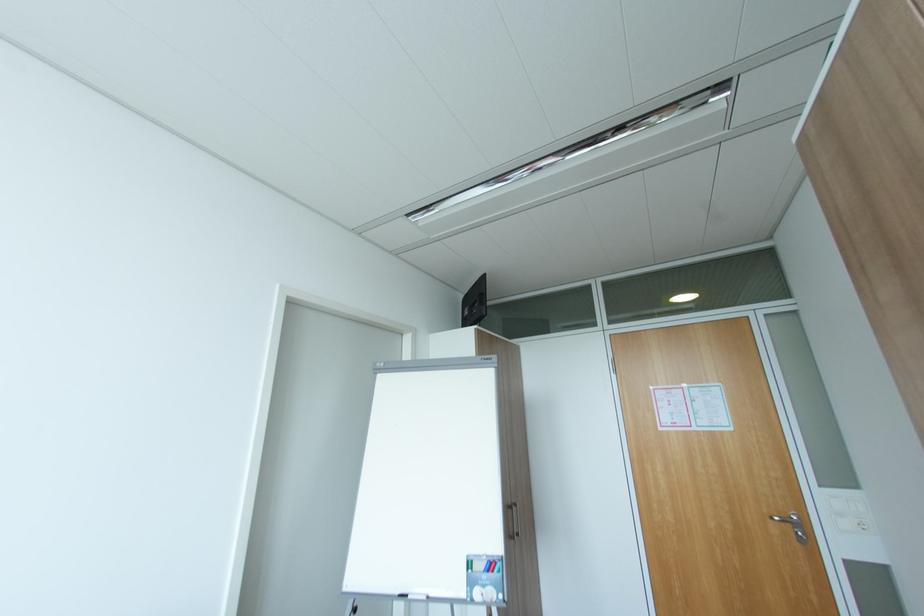
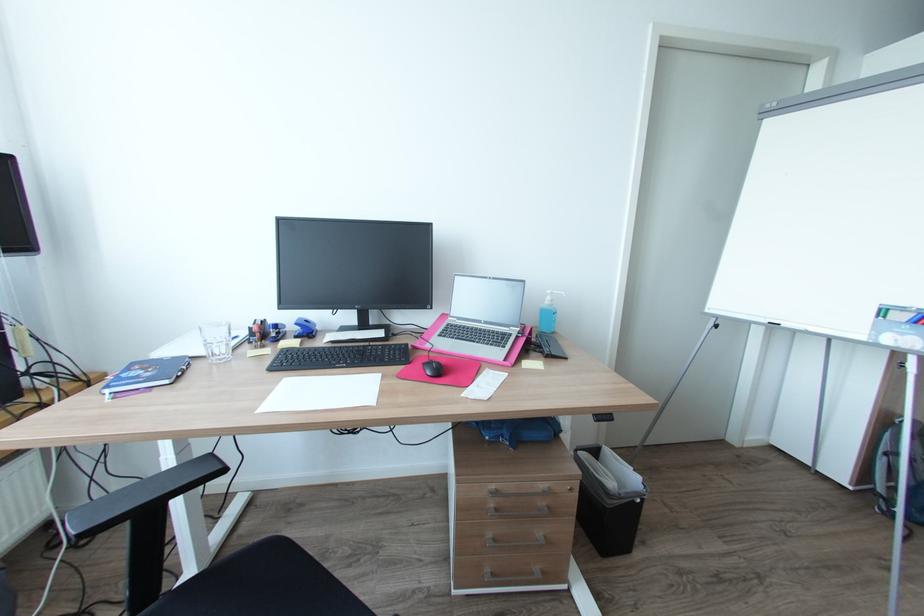
Consider the image. The first image is from the beginning of the video and the second image is from the end. How did the camera likely rotate when shooting the video?

The camera rotated toward left-down.